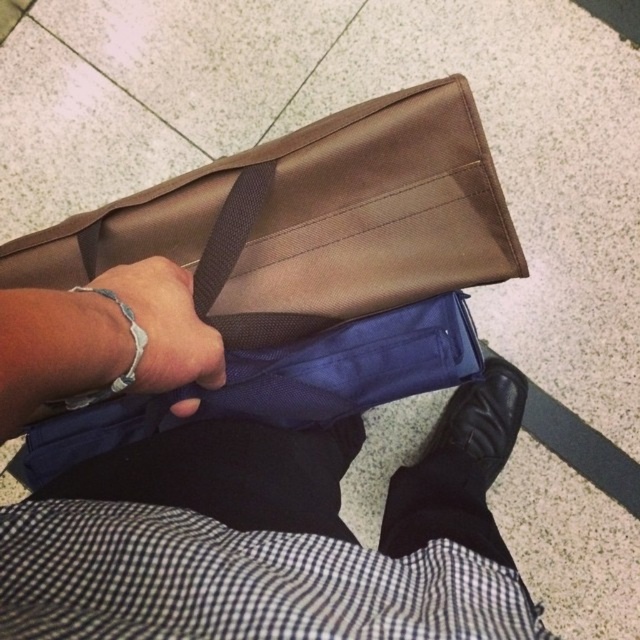
Who is positioned more to the left, matte brown bag at upper center or brown fabric strap at center?

Positioned to the left is brown fabric strap at center.

Can you confirm if matte brown bag at upper center is positioned below brown fabric strap at center?

Yes.

Who is more distant from viewer, [173,504] or [248,220]?

The point [248,220] is behind.

What are the coordinates of `matte brown bag at upper center` in the screenshot? It's located at (257, 547).

Is the position of matte brown bag at upper center less distant than that of silver metallic bracelet at center?

Yes, matte brown bag at upper center is closer to the viewer.

Is matte brown bag at upper center below silver metallic bracelet at center?

Yes, matte brown bag at upper center is below silver metallic bracelet at center.

Is point (202, 445) farther from viewer compared to point (163, 317)?

Yes.

The width and height of the screenshot is (640, 640). Find the location of `matte brown bag at upper center`. matte brown bag at upper center is located at coordinates (257, 547).

Is silver metallic bracelet at center further to the viewer compared to brown fabric strap at center?

No, it is not.

Is silver metallic bracelet at center bigger than brown fabric strap at center?

Yes.

Which is behind, point (160, 365) or point (220, 272)?

Positioned behind is point (220, 272).

You are a GUI agent. You are given a task and a screenshot of the screen. Output one action in this format:
    pyautogui.click(x=<x>, y=<y>)
    Task: Click on the silver metallic bracelet at center
    This screenshot has width=640, height=640.
    Given the screenshot: What is the action you would take?
    pyautogui.click(x=161, y=326)